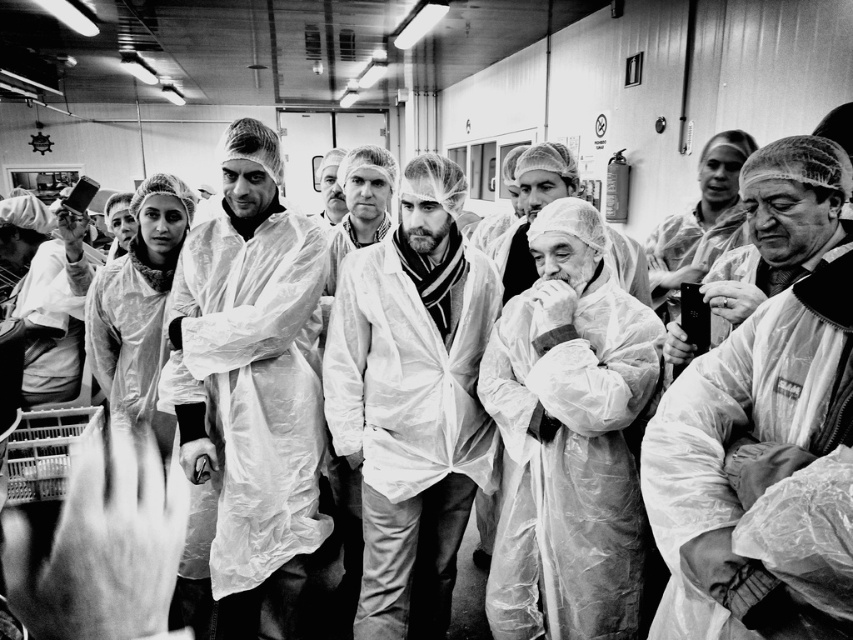
You are standing in the food processing facility and see two points marked in the image. Which point, point (753, 253) or point (56, 349), is closer to you?

Point (753, 253) is closer to you than point (56, 349).